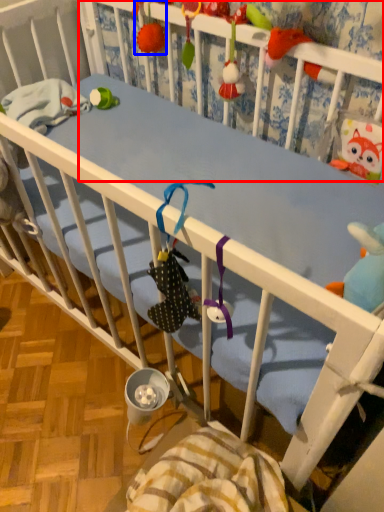
Question: Among these objects, which one is farthest to the camera, infant bed (highlighted by a red box) or toy (highlighted by a blue box)?

Choices:
 (A) infant bed
 (B) toy

Answer: (B)